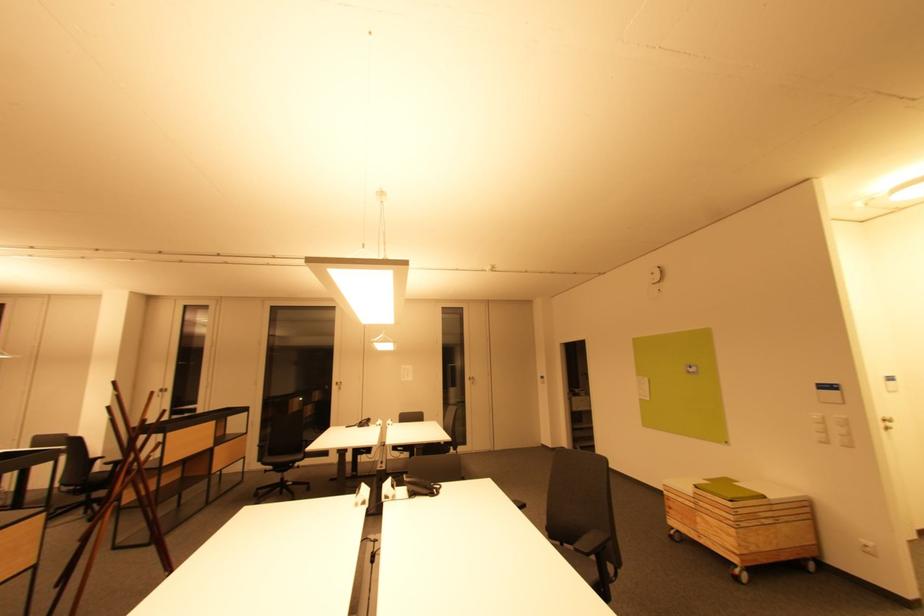
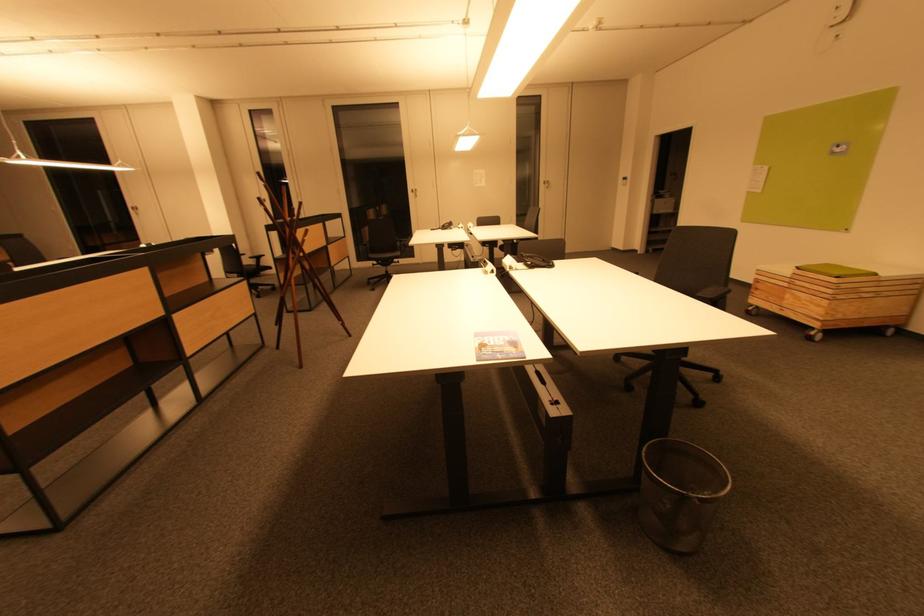
The point at (725, 532) is marked in the first image. Where is the corresponding point in the second image?

(816, 305)